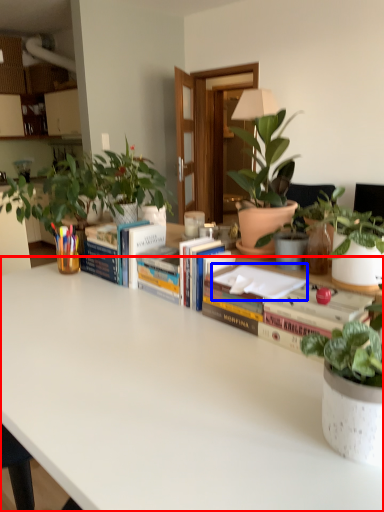
Question: Among these objects, which one is farthest to the camera, table (highlighted by a red box) or paperback book (highlighted by a blue box)?

Choices:
 (A) table
 (B) paperback book

Answer: (B)